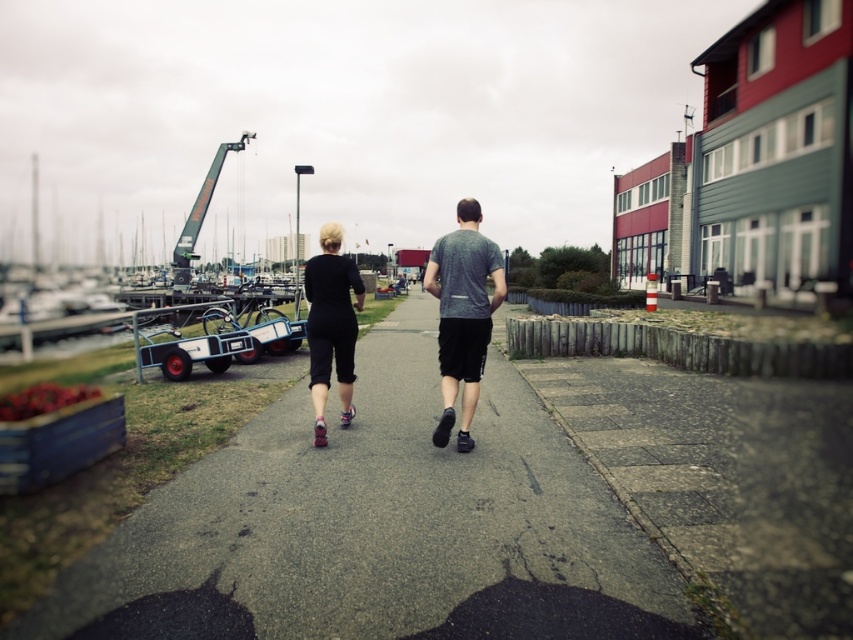
Question: Does black matte shorts at center have a lesser width compared to gray heathered t-shirt at center?

Choices:
 (A) yes
 (B) no

Answer: (B)

Question: Which of the following is the farthest from the observer?

Choices:
 (A) (463, 426)
 (B) (334, 349)
 (C) (518, 612)
 (D) (473, 387)

Answer: (B)

Question: Which object is positioned farthest from the gray heathered t-shirt at center?

Choices:
 (A) black matte pants at center
 (B) gray asphalt pavement at center
 (C) black matte shorts at center

Answer: (B)

Question: Does gray heathered t-shirt at center have a lesser width compared to black matte pants at center?

Choices:
 (A) no
 (B) yes

Answer: (A)

Question: Among these points, which one is farthest from the camera?

Choices:
 (A) (308, 348)
 (B) (474, 298)
 (C) (476, 291)
 (D) (90, 634)

Answer: (A)

Question: Does black matte shorts at center have a lesser width compared to black matte pants at center?

Choices:
 (A) yes
 (B) no

Answer: (B)